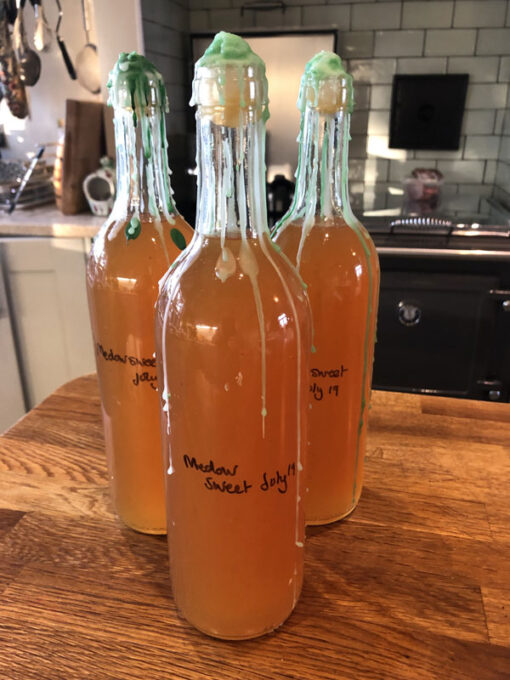
Identify the location of kitchen walls. (45, 101), (469, 37).